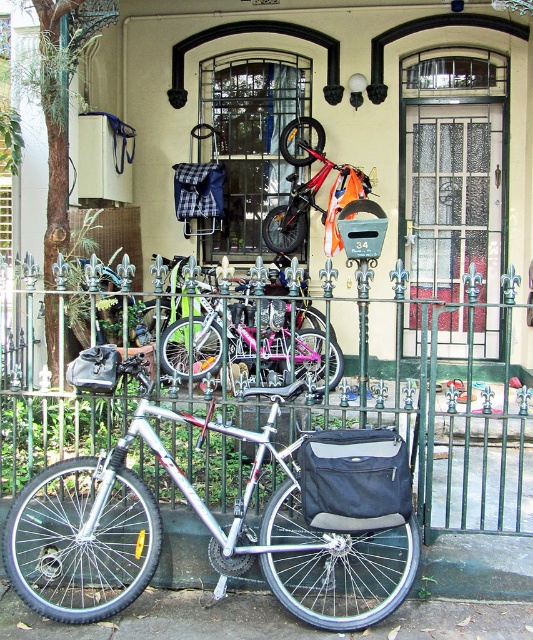
You are a delivery person trying to see if you can spot the pink metallic bicycle at center from behind the green wrought iron fence at center. Based on their heights, can you see the bicycle clearly?

The green wrought iron fence at center is shorter than the pink metallic bicycle at center, so yes, you can see the pink metallic bicycle at center clearly from behind the green wrought iron fence at center because the fence does not block the view.

You are a delivery person trying to enter the residential building. The gate is closed, and you need to determine if your delivery cart, which is 1.2 meters wide, can pass through the space between the green wrought iron fence at center and the pink metallic bicycle at center. Can it fit?

The green wrought iron fence at center is larger in size than the pink metallic bicycle at center. However, without specific measurements of the space between them, it is impossible to determine if the delivery cart can fit. Please check the actual distance on site.

You are standing in front of the residential building and want to take a photo that includes both the point at position (507, 369) and the point at position (93, 524). Since both points are at different distances from the camera, which point should you focus on to ensure both are in sharp focus?

You should focus on the point that is closer to the camera, which is point (93, 524), because focusing on the closer object will keep both in focus due to the depth of field extending beyond it.